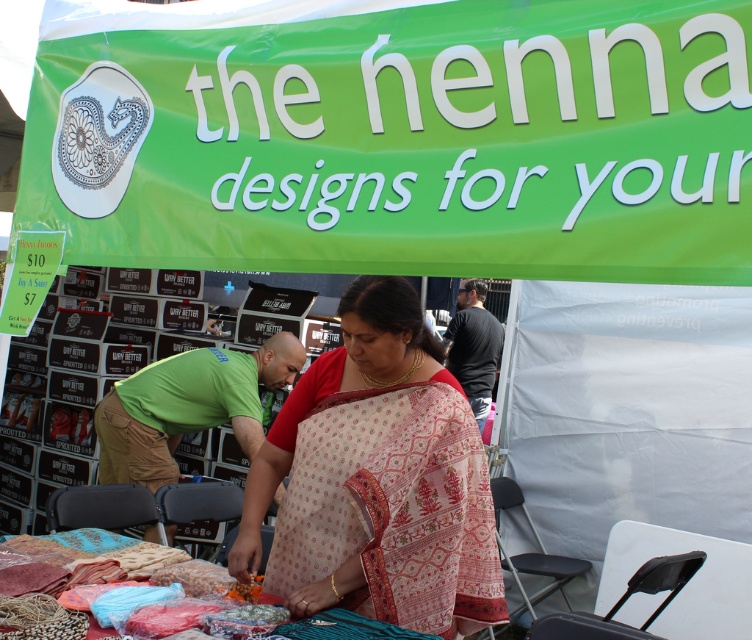
Question: Which object is farther from the camera taking this photo?

Choices:
 (A) textured fabric at center
 (B) patterned silk saree at center

Answer: (B)

Question: From the image, what is the correct spatial relationship of patterned silk saree at center in relation to textured fabric at center?

Choices:
 (A) left
 (B) right

Answer: (B)

Question: Is patterned silk saree at center behind textured fabric at center?

Choices:
 (A) yes
 (B) no

Answer: (A)

Question: Can you confirm if patterned silk saree at center is thinner than textured fabric at center?

Choices:
 (A) yes
 (B) no

Answer: (A)

Question: Which point appears closest to the camera in this image?

Choices:
 (A) (335, 616)
 (B) (331, 448)

Answer: (A)